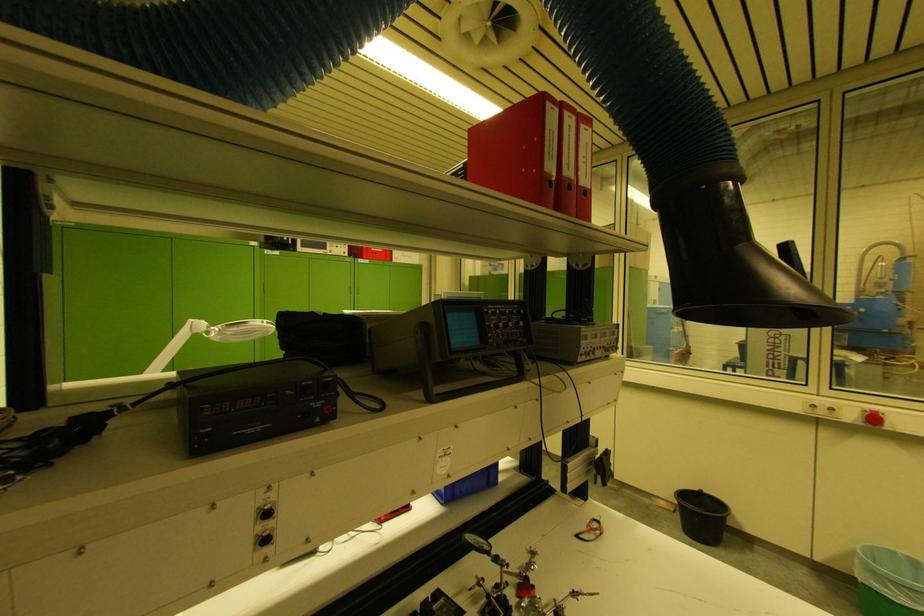
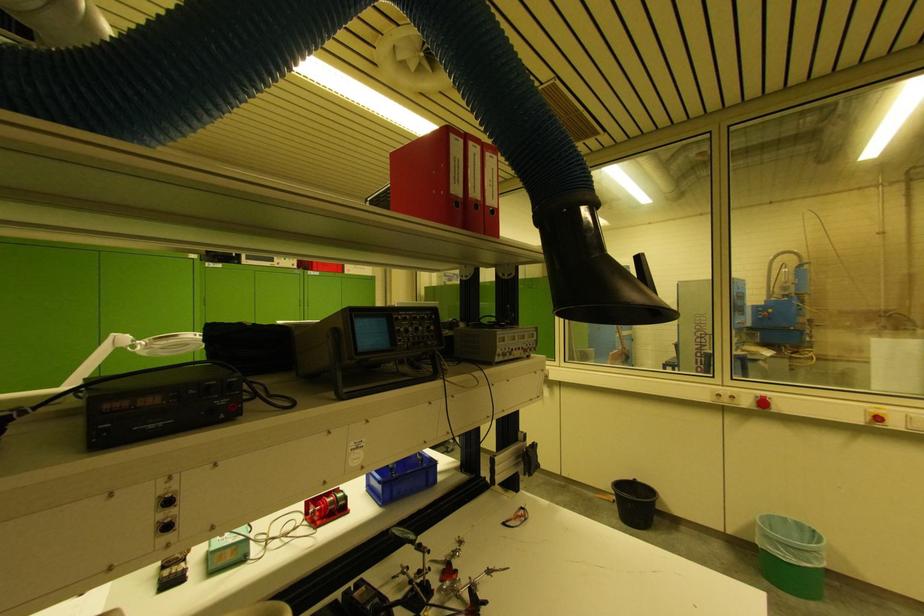
Question: How did the camera likely rotate?

Choices:
 (A) Left
 (B) Right
 (C) Up
 (D) Down

Answer: (B)